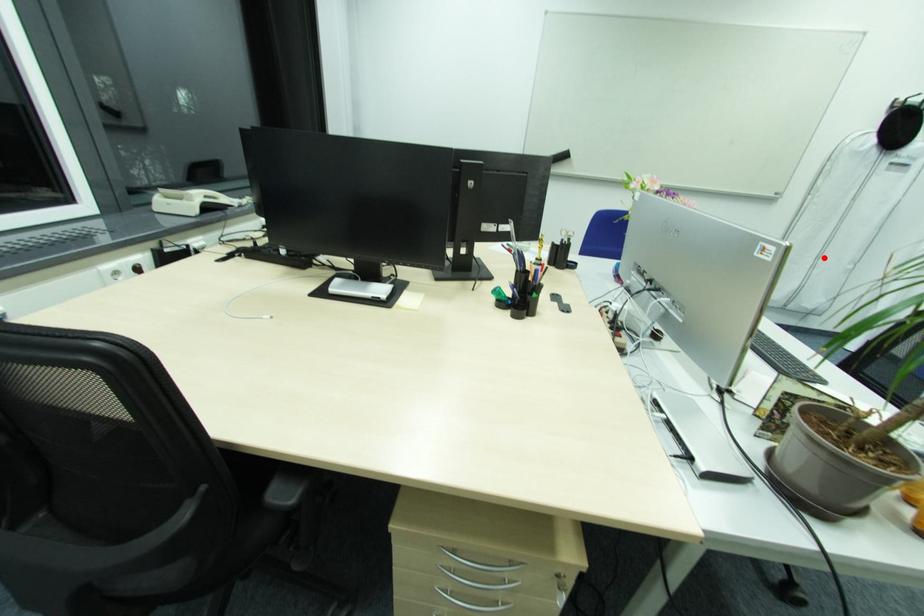
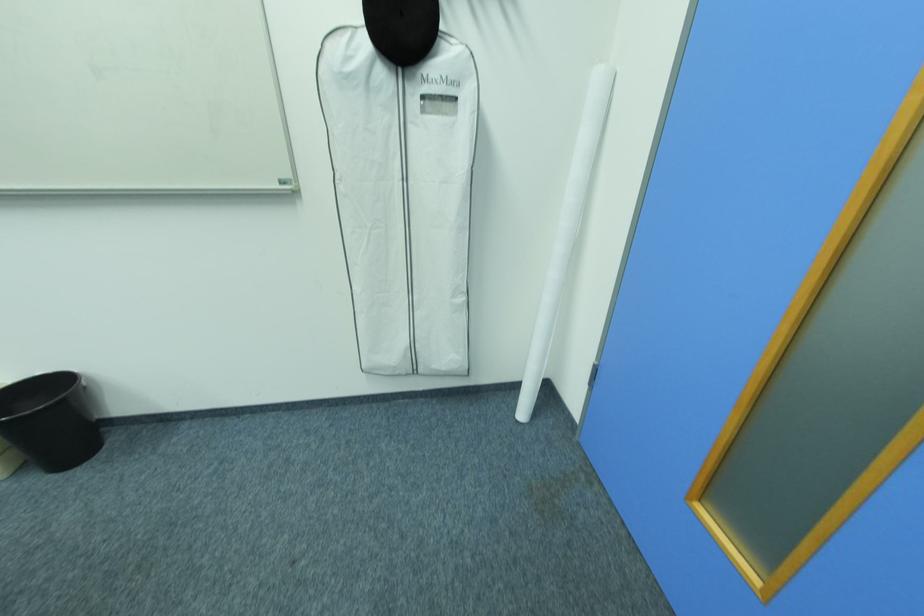
In the second image, find the point that corresponds to the highlighted location in the first image.

(416, 292)